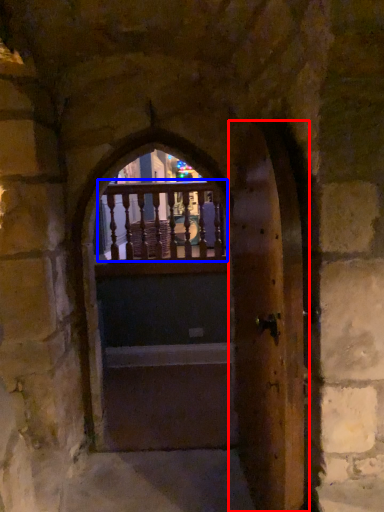
Question: Which point is further to the camera, door (highlighted by a red box) or balcony (highlighted by a blue box)?

Choices:
 (A) door
 (B) balcony

Answer: (B)